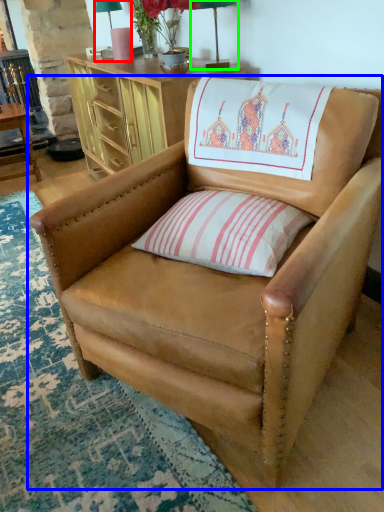
Question: Which object is the closest to the table lamp (highlighted by a red box)? Choose among these: chair (highlighted by a blue box) or table lamp (highlighted by a green box).

Choices:
 (A) chair
 (B) table lamp

Answer: (B)